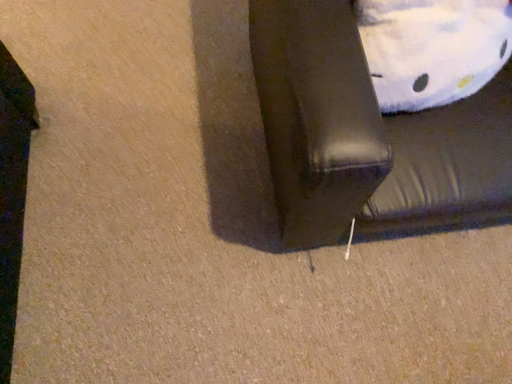
This screenshot has width=512, height=384. Describe the element at coordinates (432, 49) in the screenshot. I see `white plush pillow at upper right` at that location.

Where is `white plush pillow at upper right`? This screenshot has width=512, height=384. white plush pillow at upper right is located at coordinates (432, 49).

Consider the image. Measure the distance between black leather couch at lower right and camera.

black leather couch at lower right is 28.66 inches from camera.

What is the approximate width of black leather couch at lower right?

black leather couch at lower right is 85.75 centimeters wide.

The image size is (512, 384). What are the coordinates of `black leather couch at lower right` in the screenshot? It's located at (367, 134).

Describe the element at coordinates (367, 134) in the screenshot. The height and width of the screenshot is (384, 512). I see `black leather couch at lower right` at that location.

Where is `white plush pillow at upper right`? white plush pillow at upper right is located at coordinates (432, 49).

Looking at this image, considering the positions of objects white plush pillow at upper right and black leather couch at lower right in the image provided, who is more to the left, white plush pillow at upper right or black leather couch at lower right?

white plush pillow at upper right.

Which object is further away from the camera, white plush pillow at upper right or black leather couch at lower right?

white plush pillow at upper right is further from the camera.

Which is nearer, (488, 37) or (298, 183)?

Point (488, 37) is positioned farther from the camera compared to point (298, 183).

From the image's perspective, would you say white plush pillow at upper right is positioned over black leather couch at lower right?

Yes, from the image's perspective, white plush pillow at upper right is on top of black leather couch at lower right.

Looking at this image, from a real-world perspective, is white plush pillow at upper right physically below black leather couch at lower right?

No, from a real-world perspective, white plush pillow at upper right is not under black leather couch at lower right.

Considering the sizes of objects white plush pillow at upper right and black leather couch at lower right in the image provided, who is wider, white plush pillow at upper right or black leather couch at lower right?

Wider between the two is black leather couch at lower right.

Which of these two, white plush pillow at upper right or black leather couch at lower right, stands shorter?

With less height is white plush pillow at upper right.

Considering the relative sizes of white plush pillow at upper right and black leather couch at lower right in the image provided, is white plush pillow at upper right bigger than black leather couch at lower right?

Incorrect, white plush pillow at upper right is not larger than black leather couch at lower right.

Which is correct: white plush pillow at upper right is inside black leather couch at lower right, or outside of it?

white plush pillow at upper right is located inside black leather couch at lower right.

Does white plush pillow at upper right touch black leather couch at lower right?

white plush pillow at upper right and black leather couch at lower right are clearly separated.

Could you tell me if white plush pillow at upper right is facing black leather couch at lower right?

Yes.

How different are the orientations of white plush pillow at upper right and black leather couch at lower right in degrees?

The facing directions of white plush pillow at upper right and black leather couch at lower right are 10.3 degrees apart.

I want to click on pillow above the black leather couch at lower right (from the image's perspective), so click(x=432, y=49).

Considering the relative positions of black leather couch at lower right and white plush pillow at upper right in the image provided, is black leather couch at lower right to the left or to the right of white plush pillow at upper right?

From the image, it's evident that black leather couch at lower right is to the right of white plush pillow at upper right.

Is the position of black leather couch at lower right less distant than that of white plush pillow at upper right?

Yes, the depth of black leather couch at lower right is less than that of white plush pillow at upper right.

Which is farther from the camera, (x=394, y=147) or (x=477, y=39)?

The point (x=394, y=147) is behind.

From the image's perspective, is black leather couch at lower right under white plush pillow at upper right?

Yes, from the image's perspective, black leather couch at lower right is below white plush pillow at upper right.

From a real-world perspective, does black leather couch at lower right stand above white plush pillow at upper right?

No, from a real-world perspective, black leather couch at lower right is not on top of white plush pillow at upper right.

Consider the image. Can you confirm if black leather couch at lower right is thinner than white plush pillow at upper right?

No.

Who is shorter, black leather couch at lower right or white plush pillow at upper right?

Standing shorter between the two is white plush pillow at upper right.

Based on the photo, who is smaller, black leather couch at lower right or white plush pillow at upper right?

With smaller size is white plush pillow at upper right.

Would you say black leather couch at lower right is outside white plush pillow at upper right?

Yes.

Is black leather couch at lower right placed right next to white plush pillow at upper right?

No, black leather couch at lower right is not making contact with white plush pillow at upper right.

Is black leather couch at lower right oriented away from white plush pillow at upper right?

Yes, white plush pillow at upper right is at the back of black leather couch at lower right.

How different are the orientations of black leather couch at lower right and white plush pillow at upper right in degrees?

They differ by 10.3 degrees in their facing directions.

How distant is black leather couch at lower right from white plush pillow at upper right?

black leather couch at lower right is 7.22 inches from white plush pillow at upper right.

In the image, there is a black leather couch at lower right. Where is `pillow above it (from the image's perspective)`? pillow above it (from the image's perspective) is located at coordinates (432, 49).

The height and width of the screenshot is (384, 512). Find the location of `pillow lying behind the black leather couch at lower right`. pillow lying behind the black leather couch at lower right is located at coordinates (432, 49).

Identify the location of furniture that is below the white plush pillow at upper right (from the image's perspective). The height and width of the screenshot is (384, 512). pyautogui.click(x=367, y=134).